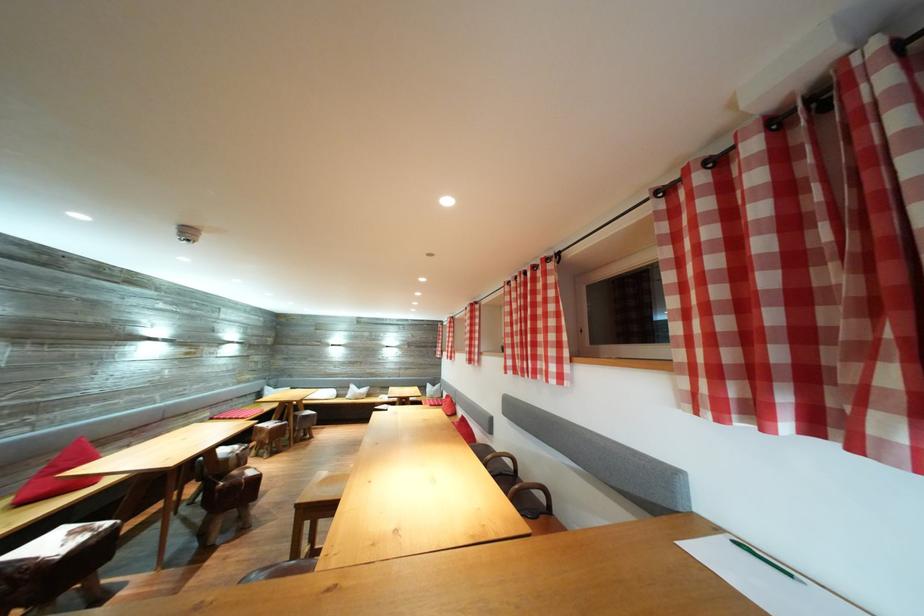
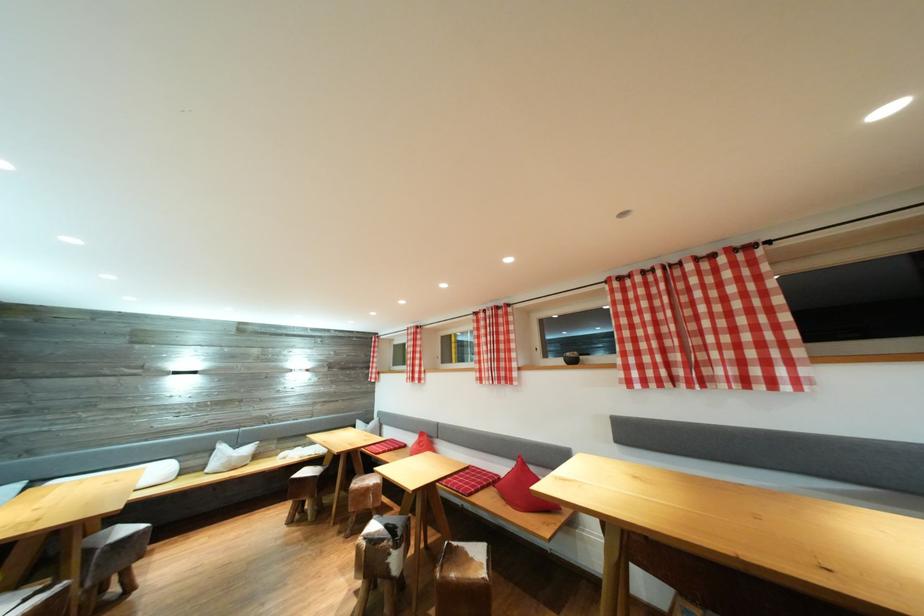
Where in the second image is the point corresponding to the point at 314,418 from the first image?

(131, 536)